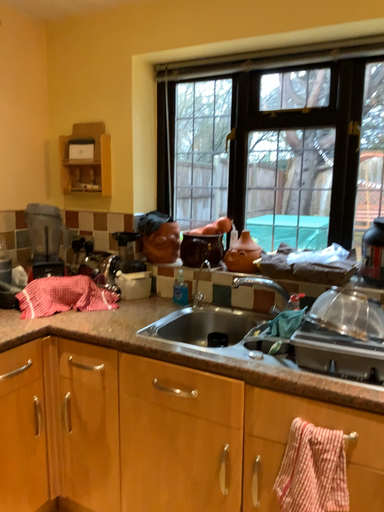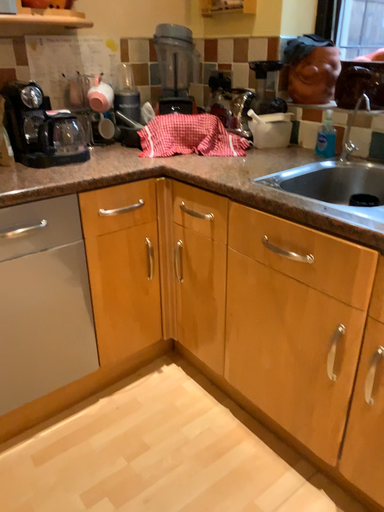
Question: How did the camera likely rotate when shooting the video?

Choices:
 (A) rotated upward
 (B) rotated downward

Answer: (B)